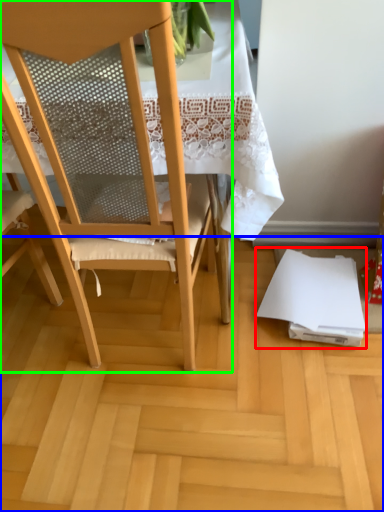
Question: Considering the real-world distances, which object is closest to notebook (highlighted by a red box)? plywood (highlighted by a blue box) or chair (highlighted by a green box).

Choices:
 (A) plywood
 (B) chair

Answer: (A)